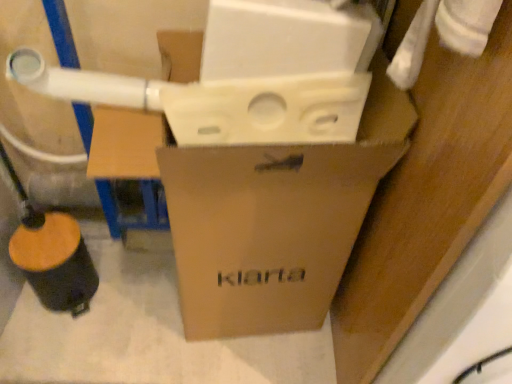
Question: From the image's perspective, is wooden/textured water pipe at lower left on top of brown cardboard box at center?

Choices:
 (A) no
 (B) yes

Answer: (A)

Question: Is wooden/textured water pipe at lower left closer to the viewer compared to brown cardboard box at center?

Choices:
 (A) yes
 (B) no

Answer: (B)

Question: Does wooden/textured water pipe at lower left have a greater height compared to brown cardboard box at center?

Choices:
 (A) yes
 (B) no

Answer: (B)

Question: Does wooden/textured water pipe at lower left touch brown cardboard box at center?

Choices:
 (A) yes
 (B) no

Answer: (B)

Question: Is wooden/textured water pipe at lower left surrounding brown cardboard box at center?

Choices:
 (A) no
 (B) yes

Answer: (A)

Question: Is wooden/textured water pipe at lower left shorter than brown cardboard box at center?

Choices:
 (A) no
 (B) yes

Answer: (B)

Question: Is brown cardboard box at center located outside wooden/textured water pipe at lower left?

Choices:
 (A) yes
 (B) no

Answer: (A)

Question: Is brown cardboard box at center oriented away from wooden/textured water pipe at lower left?

Choices:
 (A) no
 (B) yes

Answer: (A)

Question: Is brown cardboard box at center far from wooden/textured water pipe at lower left?

Choices:
 (A) no
 (B) yes

Answer: (A)

Question: Is brown cardboard box at center closer to camera compared to wooden/textured water pipe at lower left?

Choices:
 (A) yes
 (B) no

Answer: (A)

Question: Is brown cardboard box at center facing towards wooden/textured water pipe at lower left?

Choices:
 (A) yes
 (B) no

Answer: (B)

Question: Considering the relative positions of brown cardboard box at center and wooden/textured water pipe at lower left in the image provided, is brown cardboard box at center to the right of wooden/textured water pipe at lower left from the viewer's perspective?

Choices:
 (A) yes
 (B) no

Answer: (A)

Question: In terms of size, does wooden/textured water pipe at lower left appear bigger or smaller than brown cardboard box at center?

Choices:
 (A) small
 (B) big

Answer: (A)